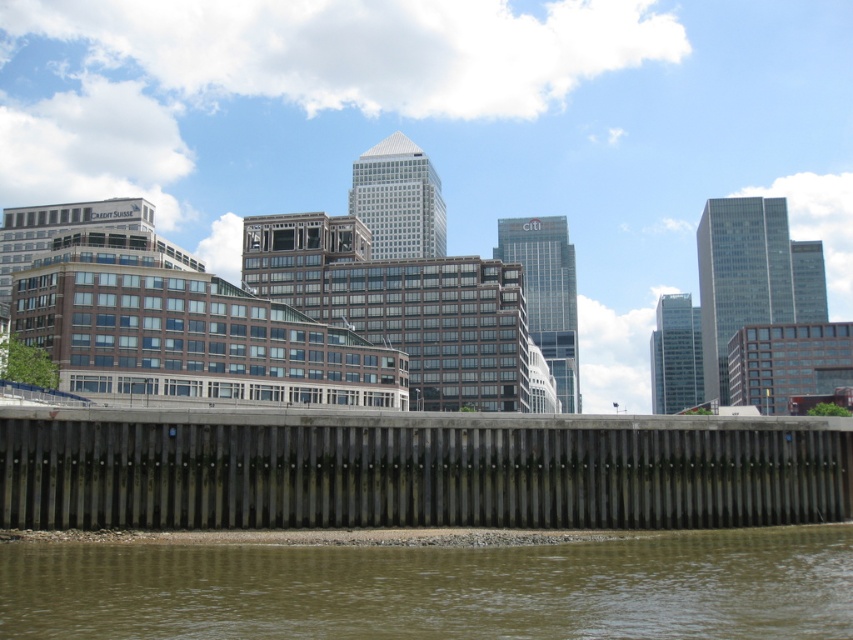
This screenshot has height=640, width=853. Describe the element at coordinates (415, 470) in the screenshot. I see `dark gray concrete dam at lower center` at that location.

Between point (164, 490) and point (268, 624), which one is positioned behind?

The point (164, 490) is behind.

The height and width of the screenshot is (640, 853). I want to click on dark gray concrete dam at lower center, so click(415, 470).